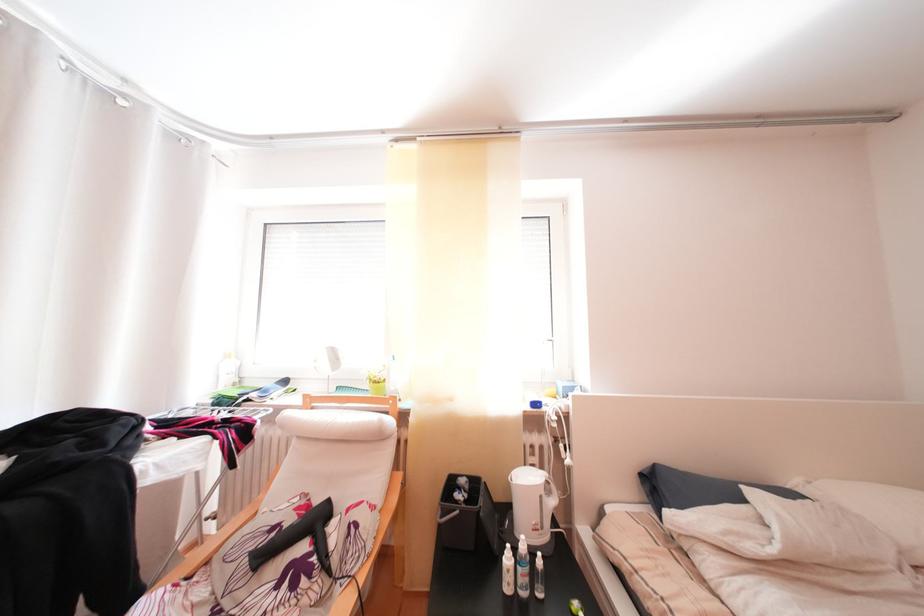
In order to click on white plastic bottle in this screenshot , I will do [x=507, y=570].